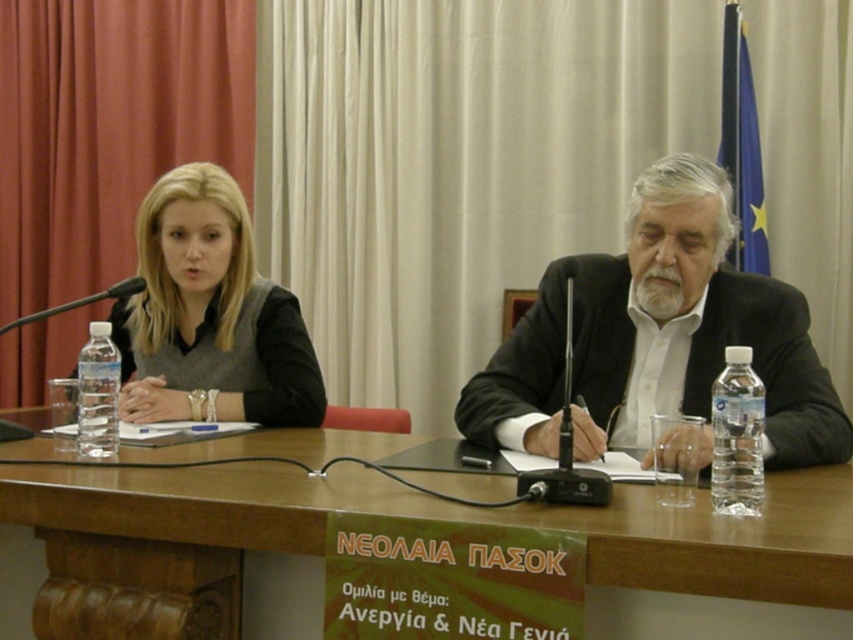
Question: Estimate the real-world distances between objects in this image. Which object is farther from the clear plastic bottle at left?

Choices:
 (A) matte gray sweater at left
 (B) white matte suit at center
 (C) brown wooden table at center
 (D) clear plastic bottle at right

Answer: (D)

Question: Is brown wooden table at center thinner than matte gray sweater at left?

Choices:
 (A) yes
 (B) no

Answer: (B)

Question: Does clear plastic bottle at right lie behind clear plastic bottle at left?

Choices:
 (A) yes
 (B) no

Answer: (B)

Question: Can you confirm if matte gray sweater at left is thinner than clear plastic bottle at right?

Choices:
 (A) no
 (B) yes

Answer: (A)

Question: Which point appears closest to the camera in this image?

Choices:
 (A) pos(817,529)
 (B) pos(636,340)

Answer: (A)

Question: Which point is farther from the camera taking this photo?

Choices:
 (A) (119, 388)
 (B) (782, 618)

Answer: (A)